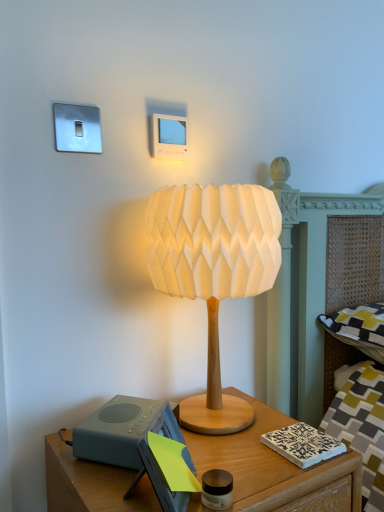
This screenshot has width=384, height=512. What are the coordinates of `blank space above wooden nightstand at lower center (from a real-world perspective)` in the screenshot? It's located at (228, 452).